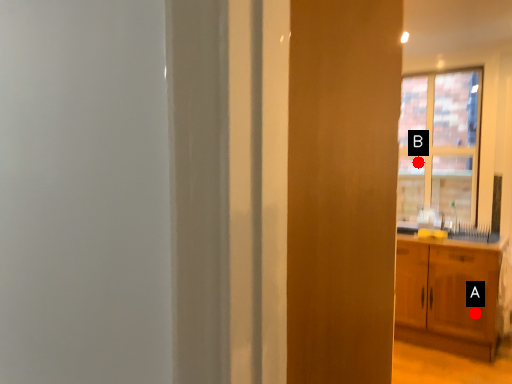
Question: Two points are circled on the image, labeled by A and B beside each circle. Which point is closer to the camera taking this photo?

Choices:
 (A) A is closer
 (B) B is closer

Answer: (A)